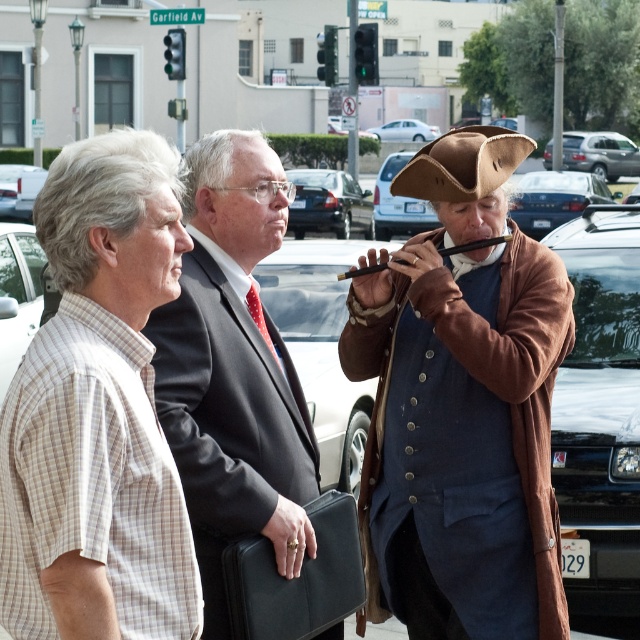
You are a delivery person who needs to place a large package between the black leather briefcase at center and the metallic silver car at center. Can the space between them accommodate the package?

The black leather briefcase at center is thinner than the metallic silver car at center, so there is enough space to place the large package between them.

Looking at this image, you are standing at the intersection of Garfield Av and need to determine the order of two points in the scene. Which point, point 1 at coordinates point (298, 186) or point 2 at coordinates point (385, 138), is closer to you?

Point 1 at coordinates point (298, 186) is closer to you than point 2 at coordinates point (385, 138).